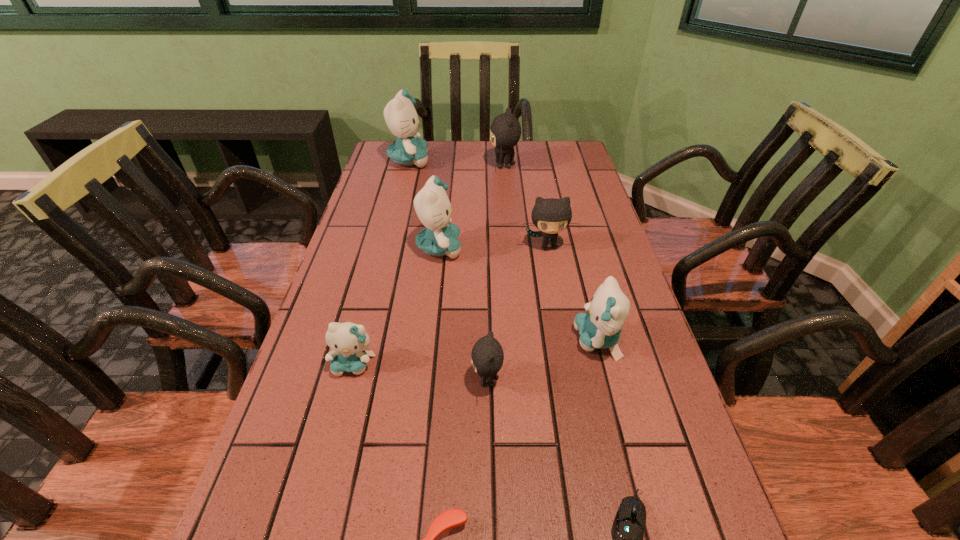
At what (x,y) coordinates should I click in order to perform the action: click on object that can be found as the third closest to the biggest gray kitten. Please return your answer as a coordinate pair (x, y). Image resolution: width=960 pixels, height=540 pixels. Looking at the image, I should click on (551, 216).

Locate which object is the fifth closest to the orange hairbrush. Please provide its 2D coordinates. Your answer should be formatted as a tuple, i.e. [(x, y)], where the tuple contains the x and y coordinates of a point satisfying the conditions above.

[(440, 237)]

The image size is (960, 540). I want to click on the second closest kitten relative to the shortest object, so click(x=600, y=328).

Locate which kitten ranks in proximity to the smallest blue kitten. Please provide its 2D coordinates. Your answer should be formatted as a tuple, i.e. [(x, y)], where the tuple contains the x and y coordinates of a point satisfying the conditions above.

[(487, 354)]

Locate which blue kitten ranks fourth in proximity to the biggest gray kitten. Please provide its 2D coordinates. Your answer should be formatted as a tuple, i.e. [(x, y)], where the tuple contains the x and y coordinates of a point satisfying the conditions above.

[(348, 341)]

Identify which blue kitten is located as the second nearest to the smallest gray kitten. Please provide its 2D coordinates. Your answer should be formatted as a tuple, i.e. [(x, y)], where the tuple contains the x and y coordinates of a point satisfying the conditions above.

[(348, 341)]

Find the location of a particular element. The width and height of the screenshot is (960, 540). gray kitten that is the third closest to the shortest object is located at coordinates (505, 131).

Find the location of `gray kitten that is the third nearest to the second farthest blue kitten`. gray kitten that is the third nearest to the second farthest blue kitten is located at coordinates (505, 131).

Where is `vacant area that satisfies the following two spatial constraints: 1. on the face of the tallest object; 2. on the face of the smallest blue kitten`? vacant area that satisfies the following two spatial constraints: 1. on the face of the tallest object; 2. on the face of the smallest blue kitten is located at coordinates (358, 364).